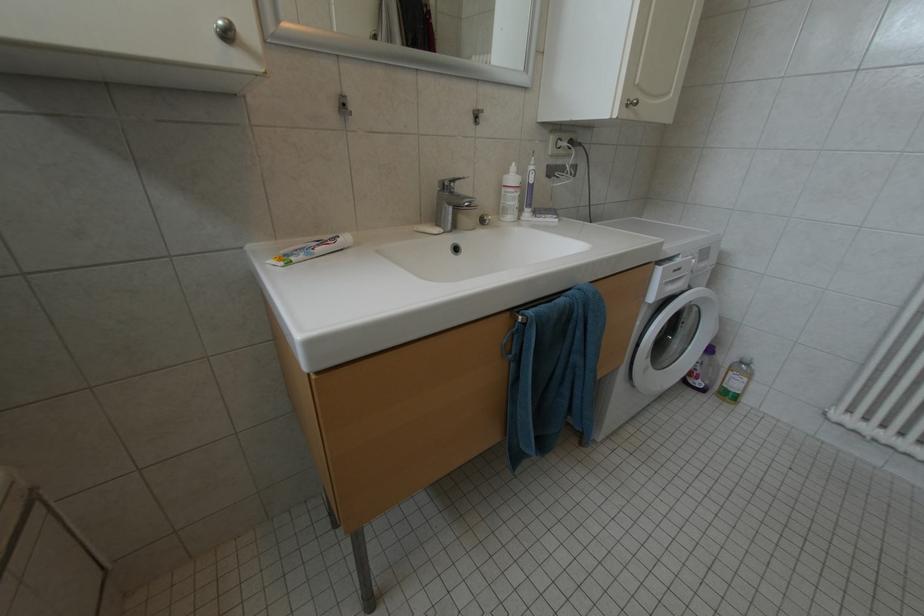
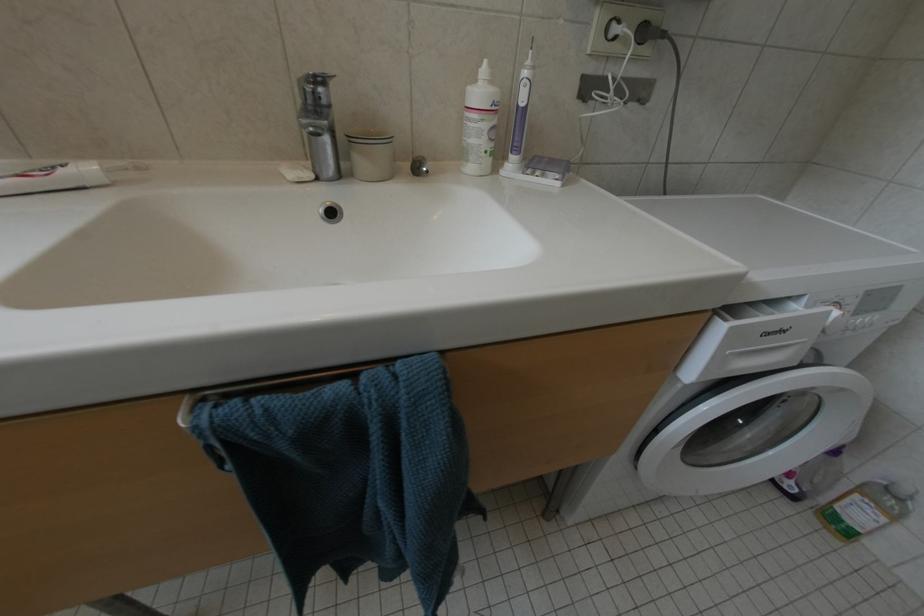
Question: The images are taken continuously from a first-person perspective. In which direction is your viewpoint rotating?

Choices:
 (A) Left
 (B) Right
 (C) Up
 (D) Down

Answer: (A)